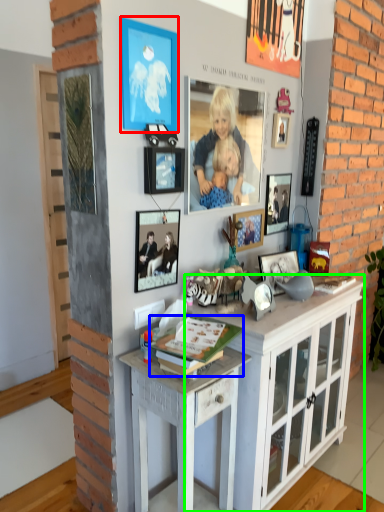
Question: Based on their relative distances, which object is farther from picture frame (highlighted by a red box)? Choose from magazine (highlighted by a blue box) and cabinetry (highlighted by a green box).

Choices:
 (A) magazine
 (B) cabinetry

Answer: (B)